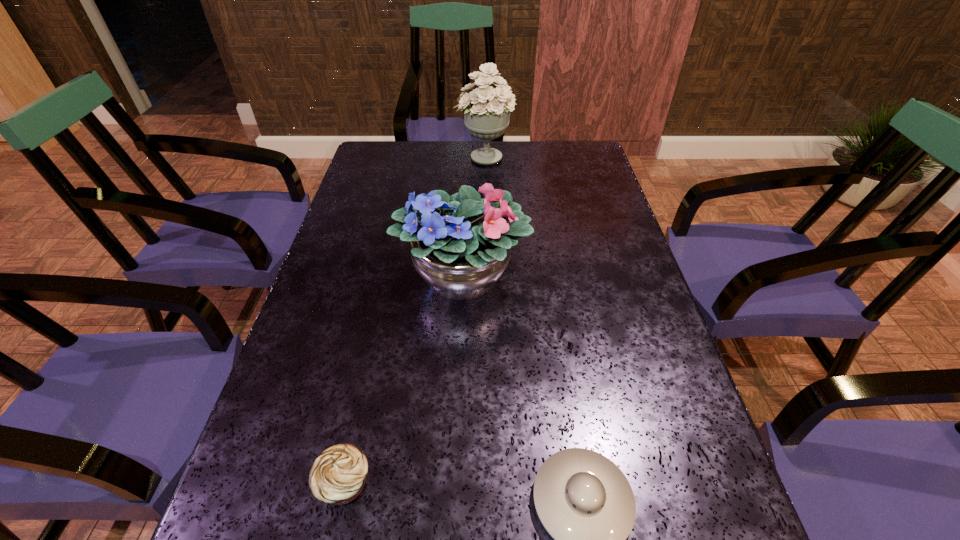
The height and width of the screenshot is (540, 960). Identify the location of vacant space at the far edge. (523, 174).

Locate an element on the screen. vacant space at the left edge of the desktop is located at coordinates (370, 208).

The width and height of the screenshot is (960, 540). What are the coordinates of `free space at the right edge of the desktop` in the screenshot? It's located at (624, 292).

Identify the location of vacant space at the far left corner of the desktop. (387, 164).

The image size is (960, 540). Identify the location of vacant area at the far right corner. (572, 168).

This screenshot has height=540, width=960. I want to click on free space between the second shortest object and the shorter bouquet, so click(x=404, y=380).

The height and width of the screenshot is (540, 960). Find the location of `vacant space in between the muffin and the farthest object`. vacant space in between the muffin and the farthest object is located at coordinates (415, 320).

Where is `unoccupied area between the third nearest object and the muffin`? The height and width of the screenshot is (540, 960). unoccupied area between the third nearest object and the muffin is located at coordinates (404, 380).

At what (x,y) coordinates should I click in order to perform the action: click on empty space between the nearer bouquet and the muffin. Please return your answer as a coordinate pair (x, y). The image size is (960, 540). Looking at the image, I should click on (404, 380).

Select which object is the second closest to the third tallest object. Please provide its 2D coordinates. Your answer should be formatted as a tuple, i.e. [(x, y)], where the tuple contains the x and y coordinates of a point satisfying the conditions above.

[(460, 244)]